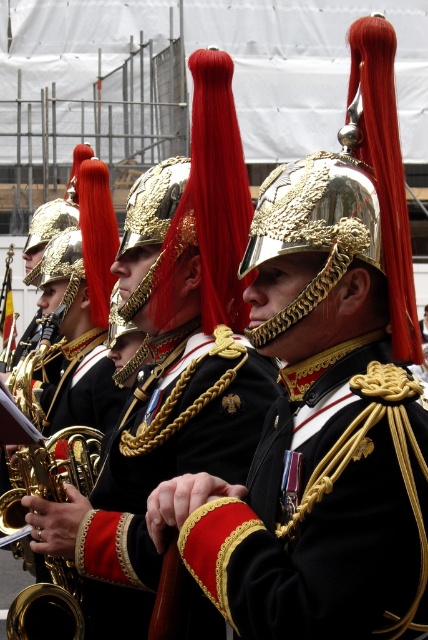
Question: Does gold brass trumpet at center have a smaller size compared to gold/gilded metal helmet at center?

Choices:
 (A) no
 (B) yes

Answer: (A)

Question: From the image, what is the correct spatial relationship of gold brass trumpet at center in relation to gold/gilded metal helmet at center?

Choices:
 (A) above
 (B) below

Answer: (B)

Question: Can you confirm if gold brass trumpet at center is bigger than gold/gilded metal helmet at center?

Choices:
 (A) yes
 (B) no

Answer: (A)

Question: Which of the following is the farthest from the observer?

Choices:
 (A) (127, 228)
 (B) (71, 612)

Answer: (A)